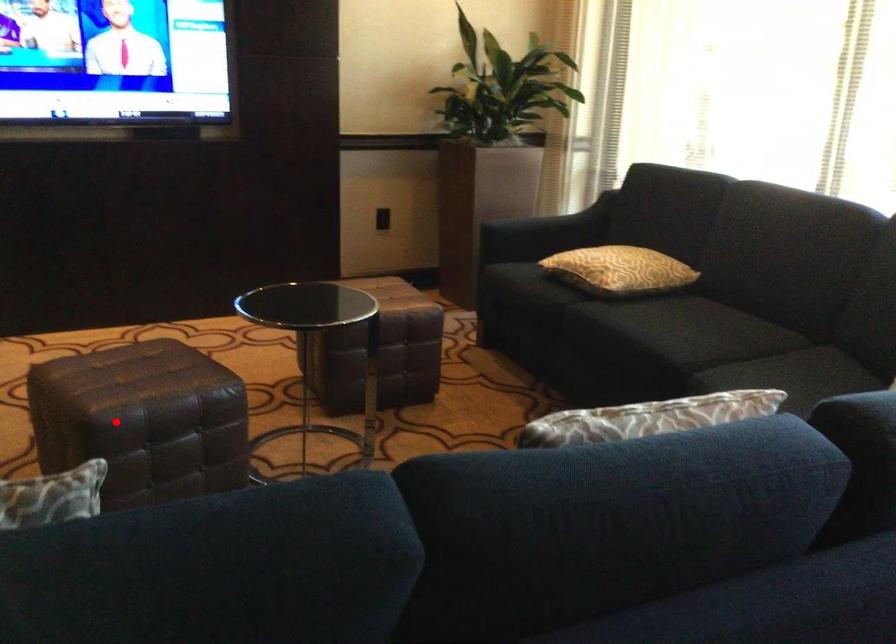
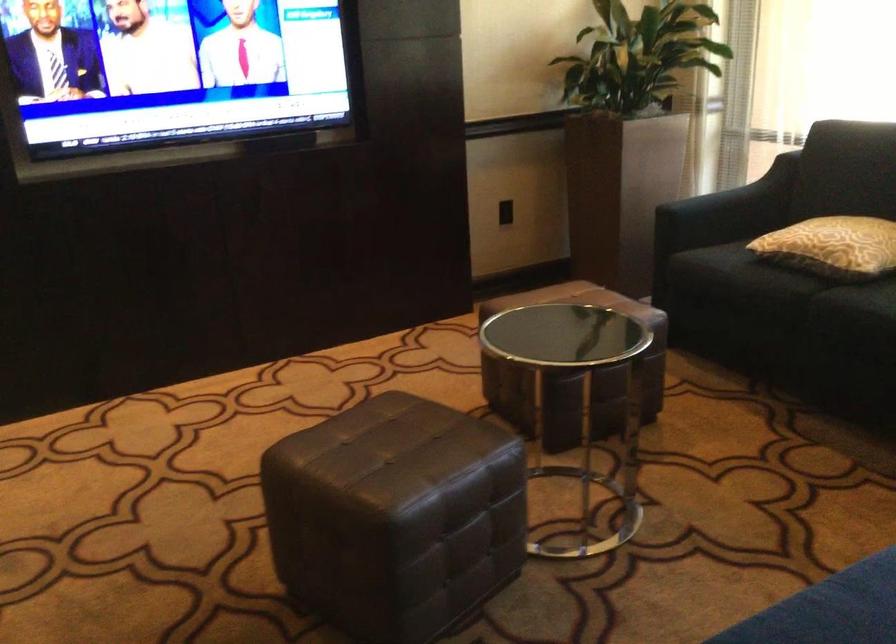
Where in the second image is the point corresponding to the highlighted location from the first image?

(394, 516)